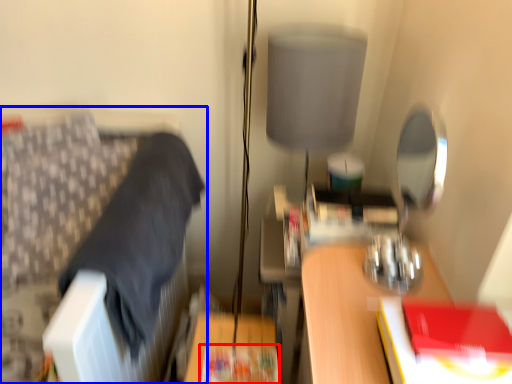
Question: Which object is closer to the camera taking this photo, paperback book (highlighted by a red box) or furniture (highlighted by a blue box)?

Choices:
 (A) paperback book
 (B) furniture

Answer: (B)